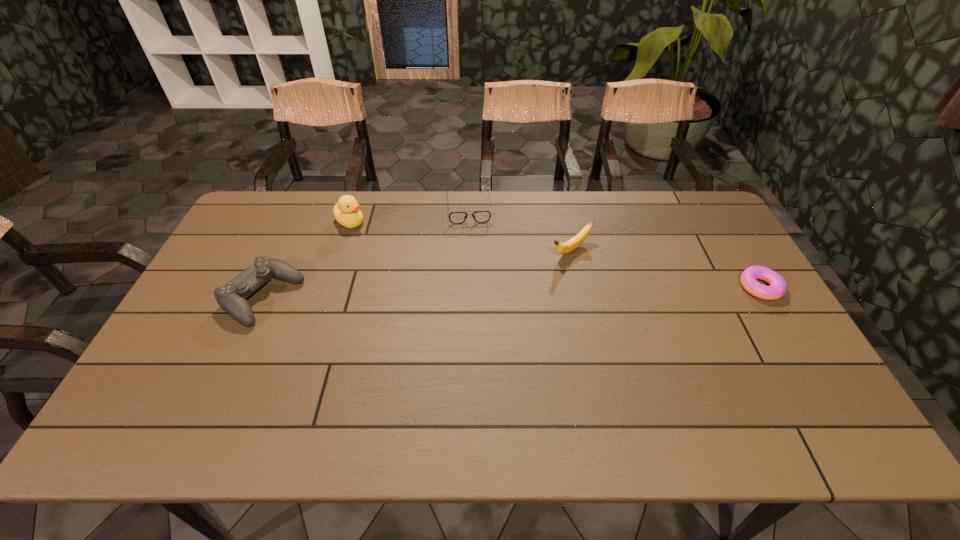
Find the location of `free space between the third object from left to right and the tallest object`. free space between the third object from left to right and the tallest object is located at coordinates (410, 215).

The height and width of the screenshot is (540, 960). Find the location of `the fourth closest object to the second object from left to right`. the fourth closest object to the second object from left to right is located at coordinates (777, 288).

Identify which object is the third nearest to the tallest object. Please provide its 2D coordinates. Your answer should be formatted as a tuple, i.e. [(x, y)], where the tuple contains the x and y coordinates of a point satisfying the conditions above.

[(566, 247)]

The width and height of the screenshot is (960, 540). I want to click on free spot that satisfies the following two spatial constraints: 1. on the back side of the banana; 2. on the right side of the third tallest object, so click(x=284, y=250).

Locate an element on the screen. The height and width of the screenshot is (540, 960). vacant region that satisfies the following two spatial constraints: 1. on the back side of the third tallest object; 2. on the left side of the second object from left to right is located at coordinates (298, 221).

The image size is (960, 540). In order to click on free location that satisfies the following two spatial constraints: 1. on the back side of the third shortest object; 2. on the right side of the fourth object from left to right in this screenshot , I will do `click(284, 250)`.

The height and width of the screenshot is (540, 960). Find the location of `vacant space that satisfies the following two spatial constraints: 1. on the front side of the rightmost object; 2. on the left side of the tallest object`. vacant space that satisfies the following two spatial constraints: 1. on the front side of the rightmost object; 2. on the left side of the tallest object is located at coordinates (329, 287).

I want to click on vacant area that satisfies the following two spatial constraints: 1. on the back side of the rightmost object; 2. on the left side of the leftmost object, so click(x=268, y=287).

Locate an element on the screen. Image resolution: width=960 pixels, height=540 pixels. vacant space that satisfies the following two spatial constraints: 1. on the back side of the doughnut; 2. on the right side of the control is located at coordinates (268, 287).